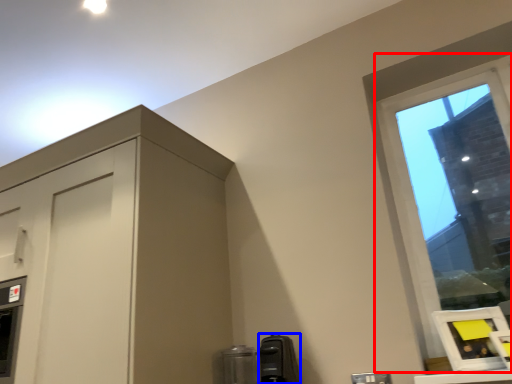
Question: Which object appears farthest to the camera in this image, window (highlighted by a red box) or appliance (highlighted by a blue box)?

Choices:
 (A) window
 (B) appliance

Answer: (B)